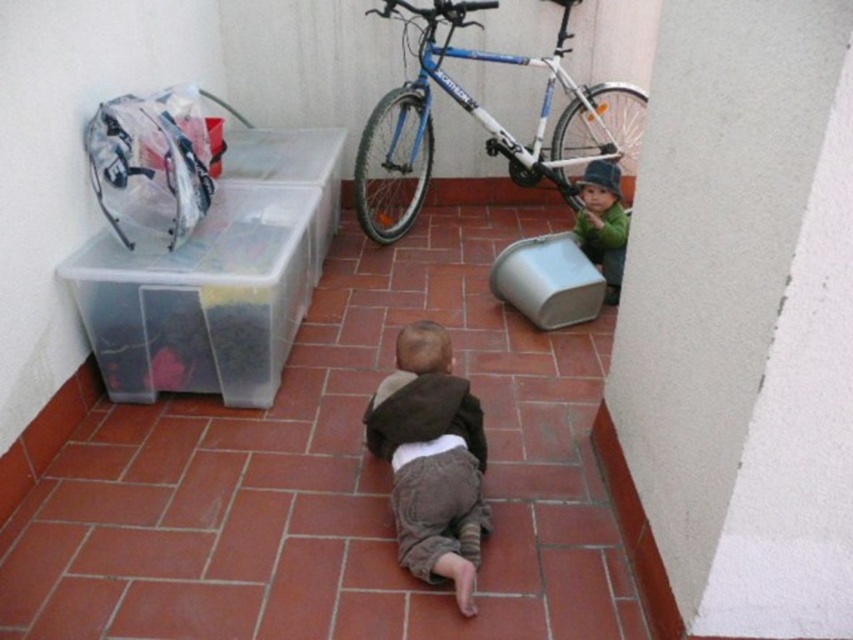
You are organizing items on a balcony and need to place the brown soft fabric at center and the green fuzzy hat at lower right. Based on their current positions, which item is closer to you?

The brown soft fabric at center is closer to you because it is in front of the green fuzzy hat at lower right.

From the picture: You are organizing items on a balcony and need to place the blue metallic bicycle at upper center and the green fuzzy hat at lower right. Considering their sizes, which item will require more space to store?

The blue metallic bicycle at upper center is bigger than the green fuzzy hat at lower right, so it will require more space to store.